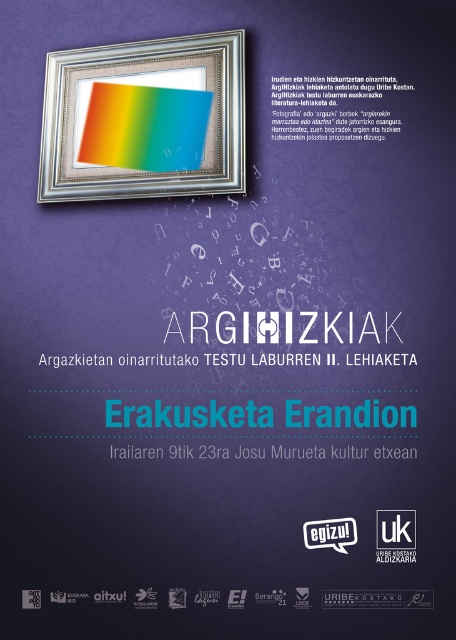
Question: Is silver metallic picture frame at upper center above rainbow paper at upper center?

Choices:
 (A) yes
 (B) no

Answer: (A)

Question: Which of the following is the farthest from the observer?

Choices:
 (A) (112, 83)
 (B) (150, 150)

Answer: (B)

Question: From the image, what is the correct spatial relationship of silver metallic picture frame at upper center in relation to rainbow paper at upper center?

Choices:
 (A) right
 (B) left

Answer: (B)

Question: Among these objects, which one is farthest from the camera?

Choices:
 (A) silver metallic picture frame at upper center
 (B) rainbow paper at upper center

Answer: (B)

Question: In this image, where is silver metallic picture frame at upper center located relative to rainbow paper at upper center?

Choices:
 (A) right
 (B) left

Answer: (B)

Question: Which point is closer to the camera taking this photo?

Choices:
 (A) (108, 164)
 (B) (115, 93)

Answer: (B)